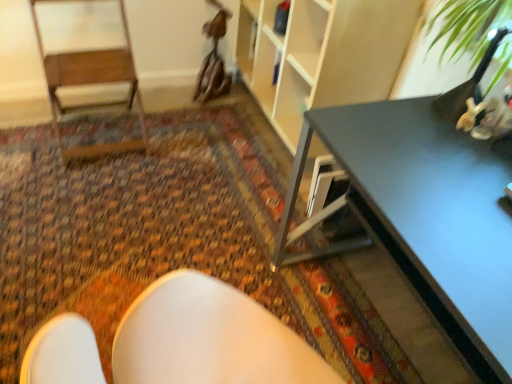
Measure the distance between point (23, 235) and camera.

The distance of point (23, 235) from camera is 5.77 feet.

Where is `matte black table at right`? This screenshot has width=512, height=384. matte black table at right is located at coordinates (426, 216).

Considering the relative positions of carpeted floor at center and matte black table at right in the image provided, is carpeted floor at center to the right of matte black table at right from the viewer's perspective?

Incorrect, carpeted floor at center is not on the right side of matte black table at right.

Consider the image. Between carpeted floor at center and matte black table at right, which one is positioned behind?

carpeted floor at center is more distant.

At what (x,y) coordinates should I click in order to perform the action: click on mat behind the matte black table at right. Please return your answer as a coordinate pair (x, y). The image size is (512, 384). Looking at the image, I should click on (168, 240).

Is carpeted floor at center facing towards matte black table at right?

No, carpeted floor at center is not oriented towards matte black table at right.

Is carpeted floor at center beside wooden armchair at left?

No.

This screenshot has height=384, width=512. I want to click on armchair on the left of the carpeted floor at center, so click(x=92, y=84).

Which is more distant, [326,344] or [112,145]?

Point [112,145]

How many degrees apart are the facing directions of carpeted floor at center and wooden armchair at left?

91.6 degrees.

Which is in front, point (511, 223) or point (30, 155)?

The point (511, 223) is more forward.

Is matte black table at right to the right of carpeted floor at center from the viewer's perspective?

Yes.

Where is `table above the carpeted floor at center (from a real-world perspective)`? The image size is (512, 384). table above the carpeted floor at center (from a real-world perspective) is located at coordinates (426, 216).

How many degrees apart are the facing directions of matte black table at right and carpeted floor at center?

matte black table at right and carpeted floor at center are facing 0.772 degrees away from each other.

You are a GUI agent. You are given a task and a screenshot of the screen. Output one action in this format:
    pyautogui.click(x=<x>, y=<y>)
    Task: Click on the table directly beneath the wooden armchair at left (from a real-world perspective)
    
    Given the screenshot: What is the action you would take?
    pyautogui.click(x=426, y=216)

From the picture: Is wooden armchair at left to the right of matte black table at right from the viewer's perspective?

In fact, wooden armchair at left is to the left of matte black table at right.

Can you confirm if wooden armchair at left is taller than matte black table at right?

Indeed, wooden armchair at left has a greater height compared to matte black table at right.

Looking at this image, considering the relative sizes of wooden armchair at left and matte black table at right in the image provided, is wooden armchair at left bigger than matte black table at right?

Actually, wooden armchair at left might be smaller than matte black table at right.

Would you say matte black table at right is outside wooden armchair at left?

Absolutely, matte black table at right is external to wooden armchair at left.

From a real-world perspective, between matte black table at right and wooden armchair at left, who is vertically lower?

matte black table at right.

Is matte black table at right next to wooden armchair at left and touching it?

No, matte black table at right is not next to wooden armchair at left.

Considering the positions of objects wooden armchair at left and carpeted floor at center in the image provided, who is more to the right, wooden armchair at left or carpeted floor at center?

carpeted floor at center is more to the right.

Is wooden armchair at left behind carpeted floor at center?

Yes, wooden armchair at left is further from the camera.

Is wooden armchair at left placed right next to carpeted floor at center?

No, wooden armchair at left is not with carpeted floor at center.

Does point (37, 2) come behind point (129, 221)?

Yes, it is behind point (129, 221).

Where is `table above the carpeted floor at center (from a real-world perspective)`? table above the carpeted floor at center (from a real-world perspective) is located at coordinates (426, 216).

Locate an element on the screen. This screenshot has height=384, width=512. armchair located behind the carpeted floor at center is located at coordinates (92, 84).

Based on their spatial positions, is wooden armchair at left or carpeted floor at center closer to matte black table at right?

carpeted floor at center lies closer to matte black table at right than the other object.

Considering their positions, is carpeted floor at center positioned closer to matte black table at right than wooden armchair at left?

Among the two, carpeted floor at center is located nearer to matte black table at right.

Based on their spatial positions, is wooden armchair at left or matte black table at right closer to carpeted floor at center?

The object closer to carpeted floor at center is wooden armchair at left.

Based on their spatial positions, is carpeted floor at center or matte black table at right further from wooden armchair at left?

Among the two, matte black table at right is located further to wooden armchair at left.

Based on their spatial positions, is matte black table at right or carpeted floor at center further from wooden armchair at left?

matte black table at right lies further to wooden armchair at left than the other object.

Which object lies further to the anchor point carpeted floor at center, matte black table at right or wooden armchair at left?

matte black table at right lies further to carpeted floor at center than the other object.

This screenshot has height=384, width=512. I want to click on mat situated between wooden armchair at left and matte black table at right from left to right, so click(x=168, y=240).